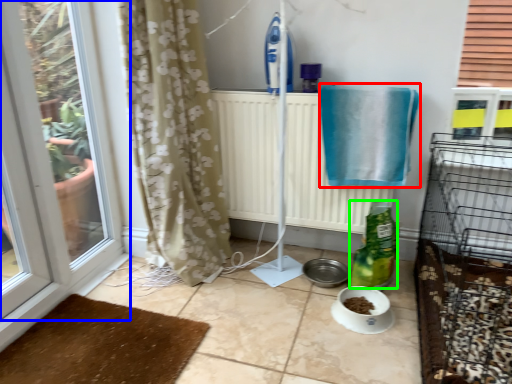
Question: Which is farther away from bath towel (highlighted by a red box)? window (highlighted by a blue box) or bottle (highlighted by a green box)?

Choices:
 (A) window
 (B) bottle

Answer: (A)